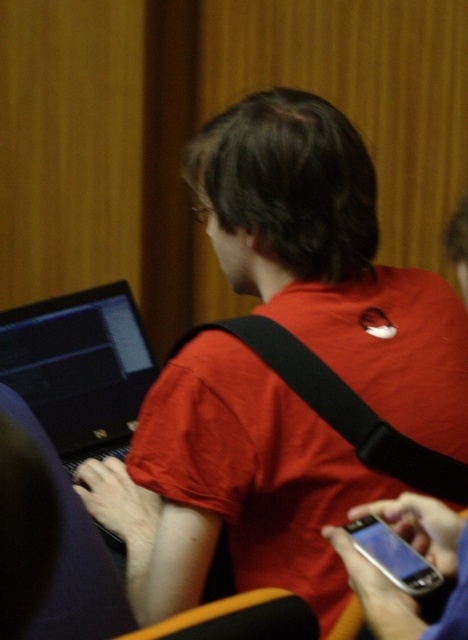
You are a delivery robot that needs to place a small package on the table where the black glossy laptop at left is located. Can you safely place the package on the table without disturbing the laptop?

The black glossy laptop at left is 1.34 meters away from the viewer, so the delivery robot can safely place the package on the table as there is enough space between the laptop and the edge of the table to avoid disturbing it.

You are a photographer trying to capture a clear shot of both the black glossy laptop at left and the silver metallic smartphone at lower right. Since the smartphone is behind the laptop, will you need to adjust your camera angle to see the smartphone without the laptop blocking it?

The silver metallic smartphone at lower right is behind the black glossy laptop at left, so you will need to adjust your camera angle to see the smartphone without the laptop blocking it.